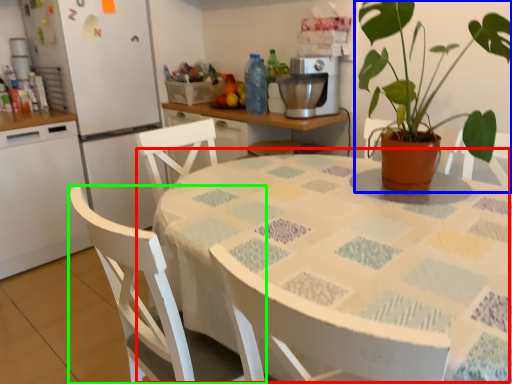
Question: Which object is positioned farthest from table (highlighted by a red box)? Select from houseplant (highlighted by a blue box) and chair (highlighted by a green box).

Choices:
 (A) houseplant
 (B) chair

Answer: (A)